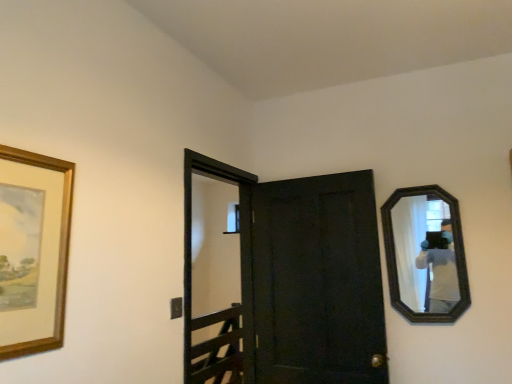
Question: Is matte black door at center completely or partially outside of wooden picture frame at left?

Choices:
 (A) yes
 (B) no

Answer: (A)

Question: Is matte black door at center closer to camera compared to wooden picture frame at left?

Choices:
 (A) yes
 (B) no

Answer: (B)

Question: Can you confirm if matte black door at center is thinner than wooden picture frame at left?

Choices:
 (A) no
 (B) yes

Answer: (A)

Question: Considering the relative sizes of matte black door at center and wooden picture frame at left in the image provided, is matte black door at center smaller than wooden picture frame at left?

Choices:
 (A) no
 (B) yes

Answer: (A)

Question: Is matte black door at center bigger than wooden picture frame at left?

Choices:
 (A) no
 (B) yes

Answer: (B)

Question: Can you confirm if matte black door at center is wider than wooden picture frame at left?

Choices:
 (A) yes
 (B) no

Answer: (A)

Question: Is black wooden screen door at center next to matte black door at center?

Choices:
 (A) yes
 (B) no

Answer: (B)

Question: Is black wooden screen door at center surrounding matte black door at center?

Choices:
 (A) no
 (B) yes

Answer: (A)

Question: Would you say black wooden screen door at center is a long distance from matte black door at center?

Choices:
 (A) yes
 (B) no

Answer: (A)

Question: Is black wooden screen door at center facing away from matte black door at center?

Choices:
 (A) yes
 (B) no

Answer: (B)

Question: Does black wooden screen door at center have a lesser width compared to matte black door at center?

Choices:
 (A) no
 (B) yes

Answer: (A)

Question: Is black wooden screen door at center smaller than matte black door at center?

Choices:
 (A) no
 (B) yes

Answer: (A)

Question: Considering the relative sizes of matte black door at center and dark wood mirror at right in the image provided, is matte black door at center bigger than dark wood mirror at right?

Choices:
 (A) no
 (B) yes

Answer: (B)